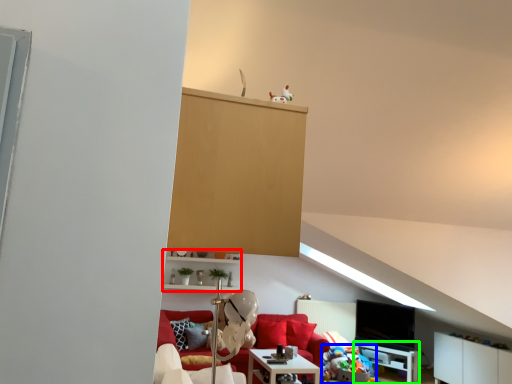
Question: Based on their relative distances, which object is farther from shelf (highlighted by a red box)? Choose from stuff (highlighted by a blue box) and table (highlighted by a green box).

Choices:
 (A) stuff
 (B) table

Answer: (B)